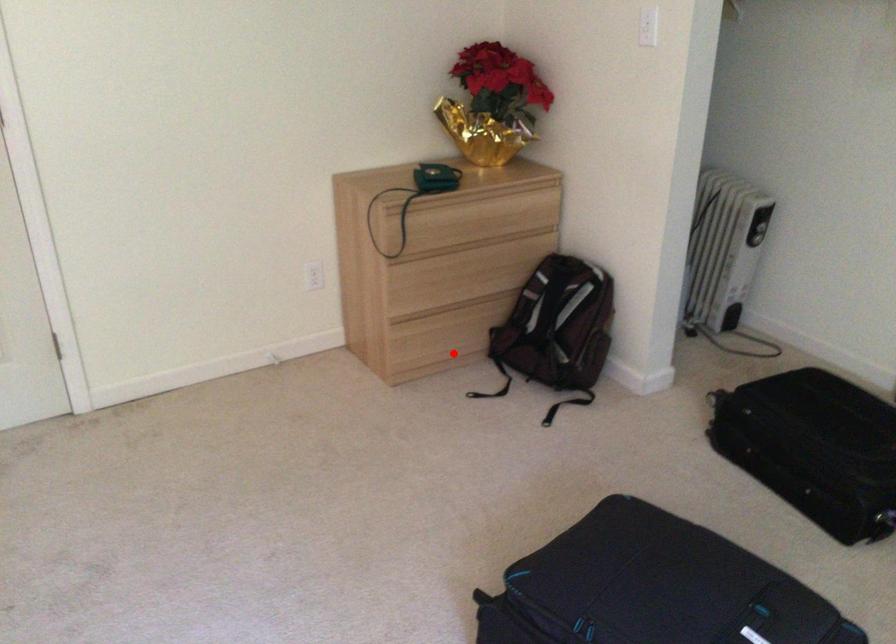
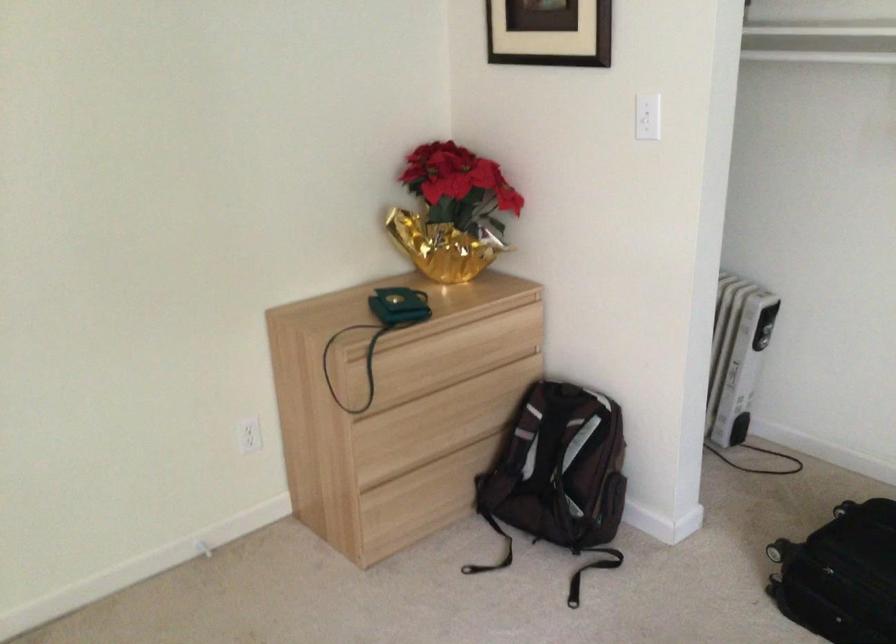
Locate, in the second image, the point that corresponds to the highlighted location in the first image.

(435, 516)